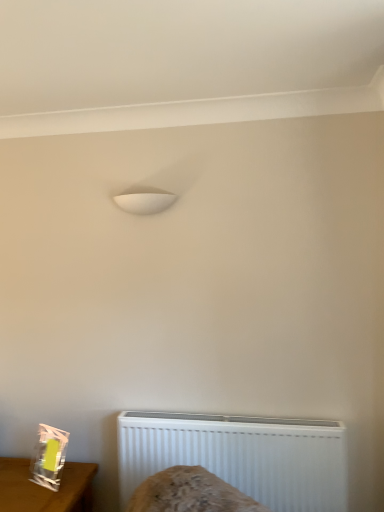
Image resolution: width=384 pixels, height=512 pixels. Describe the element at coordinates (240, 455) in the screenshot. I see `white plastic radiator at lower center` at that location.

Where is `white plastic radiator at lower center`? This screenshot has width=384, height=512. white plastic radiator at lower center is located at coordinates (240, 455).

The image size is (384, 512). In order to click on clear plastic bag at lower left in this screenshot , I will do `click(45, 488)`.

The width and height of the screenshot is (384, 512). What do you see at coordinates (45, 488) in the screenshot?
I see `clear plastic bag at lower left` at bounding box center [45, 488].

Locate an element on the screen. white plastic radiator at lower center is located at coordinates click(240, 455).

Would you say white plastic radiator at lower center is to the left or to the right of clear plastic bag at lower left in the picture?

white plastic radiator at lower center is to the right of clear plastic bag at lower left.

Considering the positions of objects white plastic radiator at lower center and clear plastic bag at lower left in the image provided, who is in front, white plastic radiator at lower center or clear plastic bag at lower left?

clear plastic bag at lower left is closer to the camera.

Does point (310, 459) come farther from viewer compared to point (79, 501)?

No.

From the image's perspective, relative to clear plastic bag at lower left, is white plastic radiator at lower center above or below?

From the image's perspective, white plastic radiator at lower center appears above clear plastic bag at lower left.

From a real-world perspective, is white plastic radiator at lower center on clear plastic bag at lower left?

Yes.

Between white plastic radiator at lower center and clear plastic bag at lower left, which one has larger width?

clear plastic bag at lower left.

Considering the sizes of white plastic radiator at lower center and clear plastic bag at lower left in the image, is white plastic radiator at lower center taller or shorter than clear plastic bag at lower left?

Considering their sizes, white plastic radiator at lower center has more height than clear plastic bag at lower left.

Does white plastic radiator at lower center have a smaller size compared to clear plastic bag at lower left?

Correct, white plastic radiator at lower center occupies less space than clear plastic bag at lower left.

Is white plastic radiator at lower center not within clear plastic bag at lower left?

Yes, white plastic radiator at lower center is located beyond the bounds of clear plastic bag at lower left.

Is white plastic radiator at lower center far from clear plastic bag at lower left?

white plastic radiator at lower center is actually quite close to clear plastic bag at lower left.

Is white plastic radiator at lower center positioned with its back to clear plastic bag at lower left?

No, white plastic radiator at lower center is not facing the opposite direction of clear plastic bag at lower left.

How different are the orientations of white plastic radiator at lower center and clear plastic bag at lower left in degrees?

The angular difference between white plastic radiator at lower center and clear plastic bag at lower left is 0.562 degrees.

How distant is white plastic radiator at lower center from clear plastic bag at lower left?

white plastic radiator at lower center is 22.16 inches from clear plastic bag at lower left.

Locate an element on the screen. radiator that is on the right side of clear plastic bag at lower left is located at coordinates (240, 455).

Which object is positioned more to the left, clear plastic bag at lower left or white plastic radiator at lower center?

clear plastic bag at lower left.

Is clear plastic bag at lower left in front of or behind white plastic radiator at lower center in the image?

clear plastic bag at lower left is positioned closer to the viewer than white plastic radiator at lower center.

Is point (38, 502) closer to viewer compared to point (311, 490)?

Yes, point (38, 502) is closer to viewer.

From the image's perspective, is clear plastic bag at lower left above white plastic radiator at lower center?

Incorrect, from the image's perspective, clear plastic bag at lower left is lower than white plastic radiator at lower center.

From a real-world perspective, which is physically above, clear plastic bag at lower left or white plastic radiator at lower center?

white plastic radiator at lower center.

Can you confirm if clear plastic bag at lower left is thinner than white plastic radiator at lower center?

Incorrect, the width of clear plastic bag at lower left is not less than that of white plastic radiator at lower center.

Can you confirm if clear plastic bag at lower left is shorter than white plastic radiator at lower center?

Yes.

Which of these two, clear plastic bag at lower left or white plastic radiator at lower center, is bigger?

With larger size is clear plastic bag at lower left.

Is clear plastic bag at lower left surrounding white plastic radiator at lower center?

No, white plastic radiator at lower center is located outside of clear plastic bag at lower left.

Would you consider clear plastic bag at lower left to be distant from white plastic radiator at lower center?

No, clear plastic bag at lower left is not far from white plastic radiator at lower center.

Is clear plastic bag at lower left facing towards white plastic radiator at lower center?

No, clear plastic bag at lower left is not turned towards white plastic radiator at lower center.

Can you tell me how much clear plastic bag at lower left and white plastic radiator at lower center differ in facing direction?

They differ by 0.562 degrees in their facing directions.

Find the location of `radiator that is above the clear plastic bag at lower left (from the image's perspective)`. radiator that is above the clear plastic bag at lower left (from the image's perspective) is located at coordinates (240, 455).

Find the location of a particular element. The image size is (384, 512). radiator on the right of the clear plastic bag at lower left is located at coordinates (240, 455).

Find the location of a particular element. radiator that is above the clear plastic bag at lower left (from a real-world perspective) is located at coordinates (240, 455).